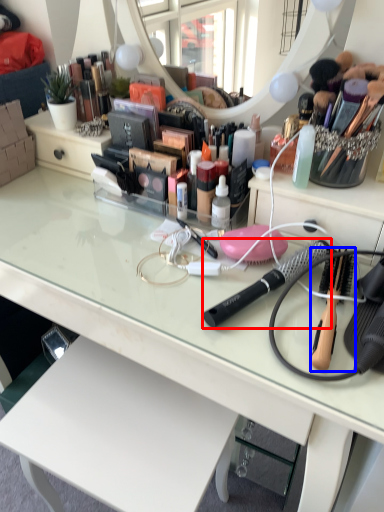
Question: Which point is further to the camera, brush (highlighted by a red box) or brush (highlighted by a blue box)?

Choices:
 (A) brush
 (B) brush

Answer: (A)